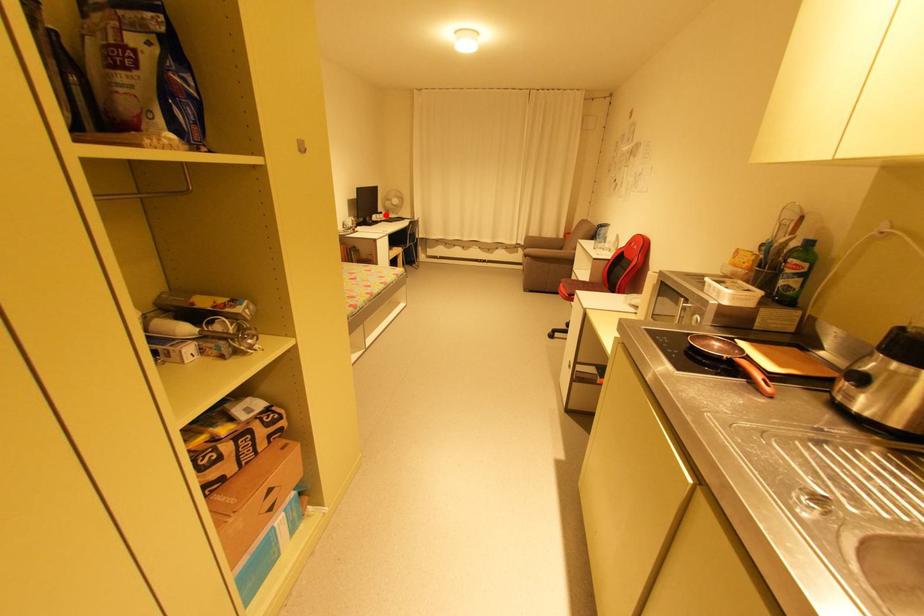
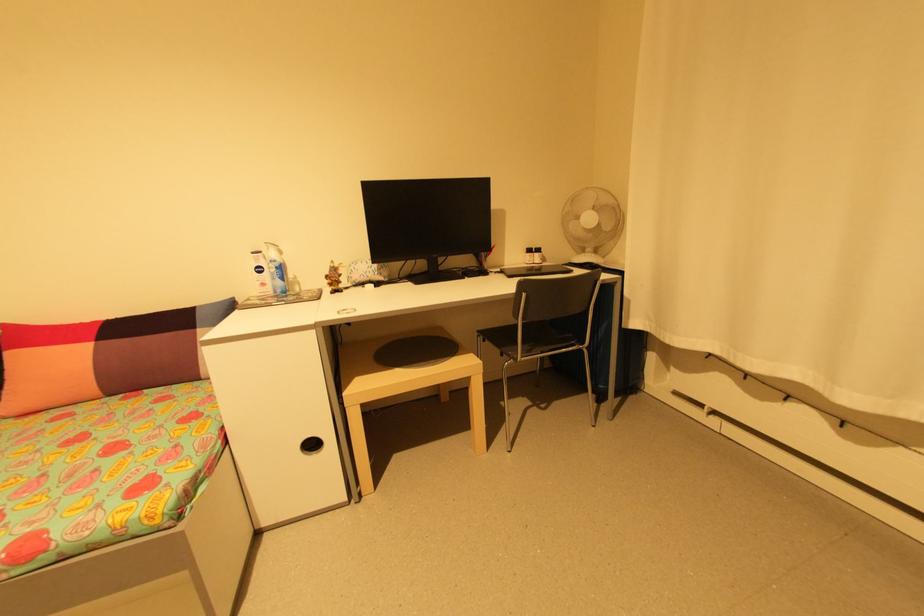
Where in the second image is the point corresponding to the highlighted location from the first image?

(541, 254)